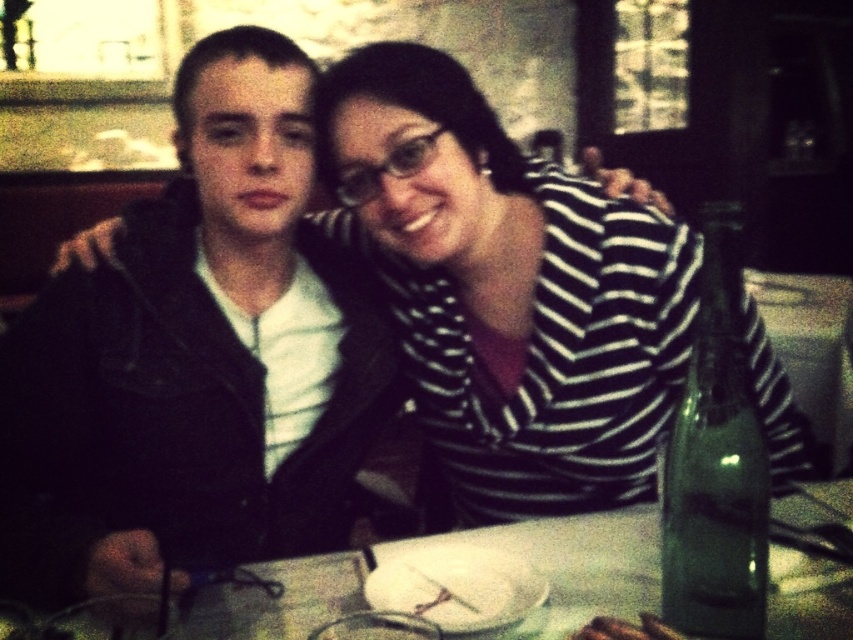
Question: Which object is farther from the camera taking this photo?

Choices:
 (A) brown crumbly bread at table center
 (B) white glossy table at center

Answer: (B)

Question: Among these objects, which one is nearest to the camera?

Choices:
 (A) striped fabric shirt at center
 (B) brown crumbly bread at table center

Answer: (B)

Question: Is striped fabric shirt at center positioned in front of brown crumbly bread at table center?

Choices:
 (A) no
 (B) yes

Answer: (A)

Question: Does striped fabric shirt at center come in front of white glossy table at center?

Choices:
 (A) yes
 (B) no

Answer: (B)

Question: Is denim jacket at left to the left of brown crumbly bread at table center from the viewer's perspective?

Choices:
 (A) no
 (B) yes

Answer: (B)

Question: Which object is closer to the camera taking this photo?

Choices:
 (A) white glossy table at center
 (B) denim jacket at left

Answer: (A)